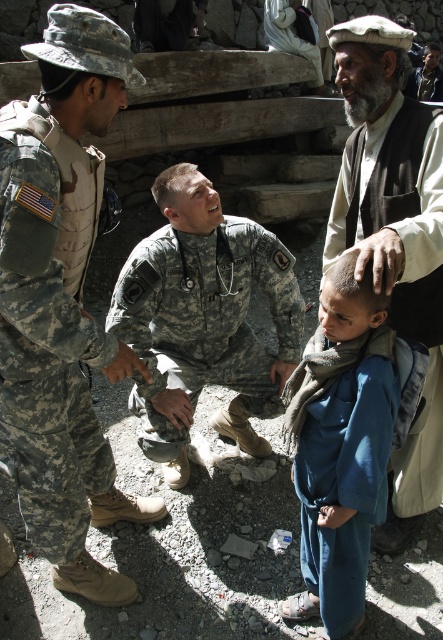
Between camouflage fabric uniform at left and camouflage uniform at center, which one has less height?

camouflage uniform at center is shorter.

Which is behind, point (58, 298) or point (124, 320)?

The point (124, 320) is behind.

Find the location of `camouflage fabric uniform at left`. camouflage fabric uniform at left is located at coordinates (50, 326).

Is point (175, 307) behind point (415, 403)?

Yes, it is.

I want to click on camouflage uniform at center, so click(202, 317).

From the picture: Can you confirm if white woolen cap at upper right is shorter than blue cotton scarf at lower center?

No.

Between white woolen cap at upper right and blue cotton scarf at lower center, which one appears on the left side from the viewer's perspective?

blue cotton scarf at lower center

What do you see at coordinates (395, 236) in the screenshot?
I see `white woolen cap at upper right` at bounding box center [395, 236].

At what (x,y) coordinates should I click in order to perform the action: click on white woolen cap at upper right. Please return your answer as a coordinate pair (x, y). Looking at the image, I should click on (395, 236).